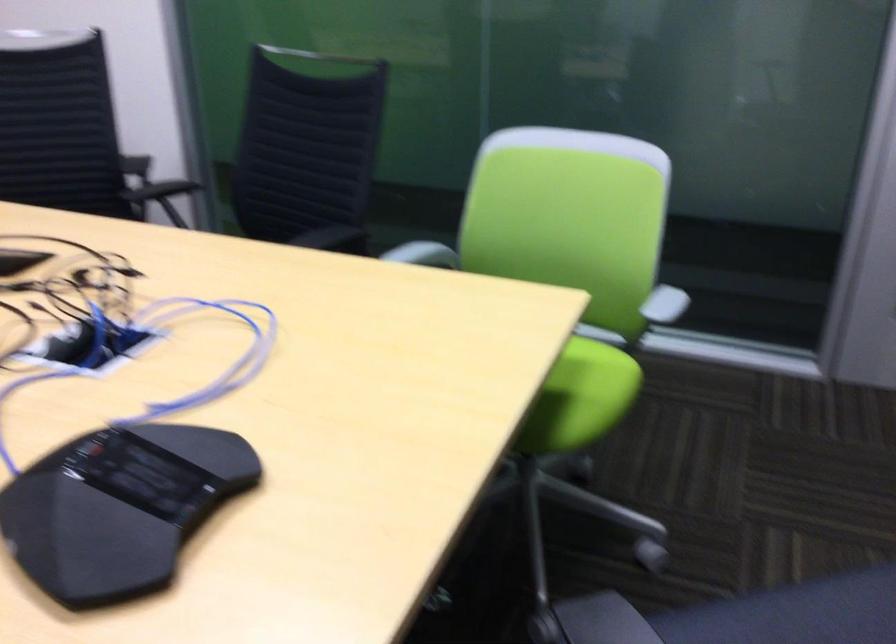
This screenshot has width=896, height=644. Find the location of `white chair armrest`. white chair armrest is located at coordinates (659, 310).